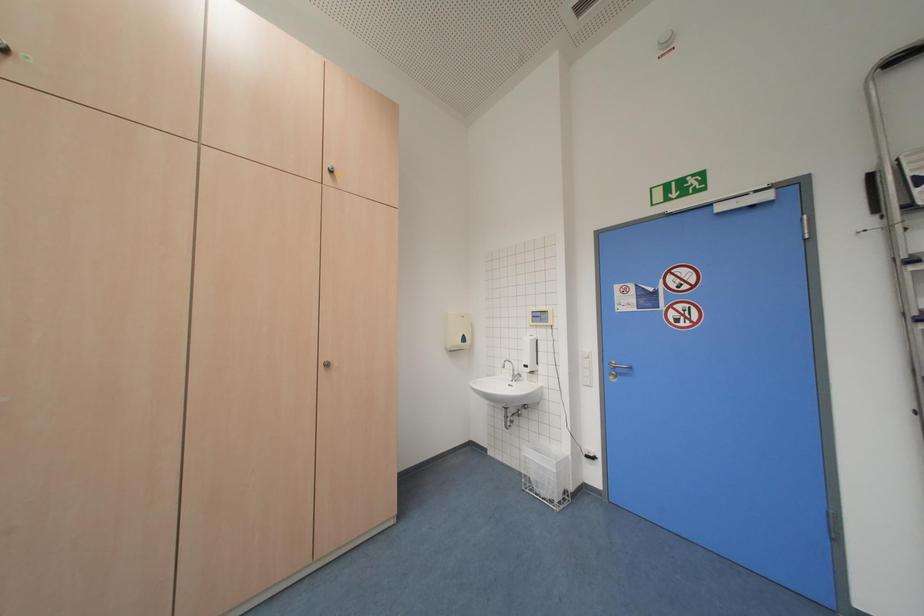
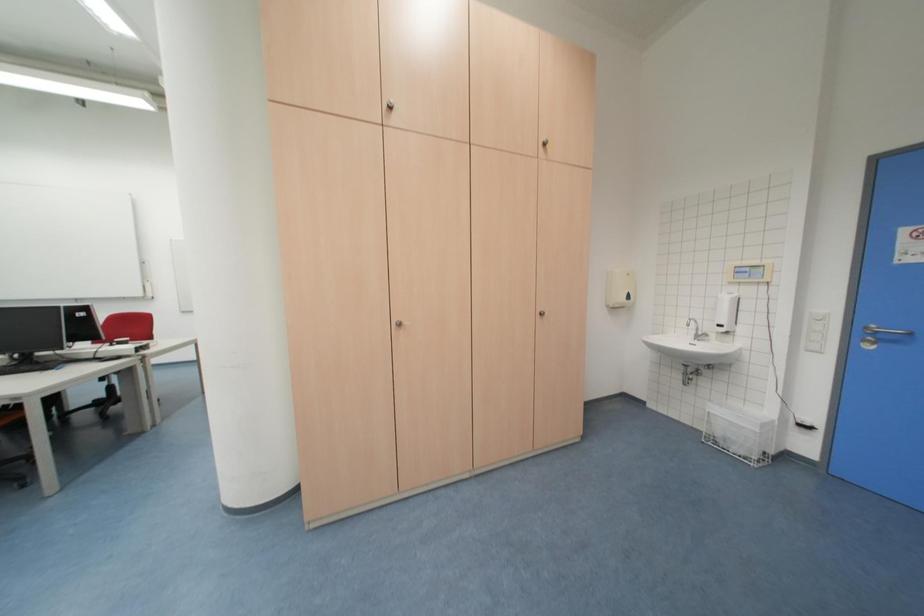
Question: The camera is either moving clockwise (left) or counter-clockwise (right) around the object. The first image is from the beginning of the video and the second image is from the end. Is the camera moving left or right when shooting the video?

Choices:
 (A) Left
 (B) Right

Answer: (B)